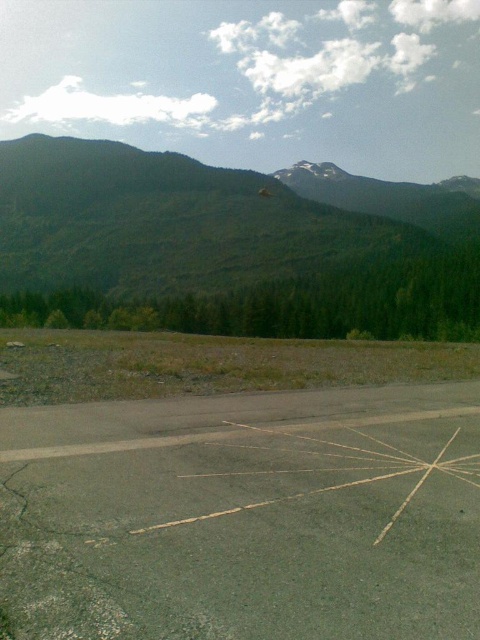
Does gray asphalt parking lot at center have a larger size compared to green forested mountain at upper left?

Incorrect, gray asphalt parking lot at center is not larger than green forested mountain at upper left.

Does point (393, 406) come farther from viewer compared to point (459, 260)?

No, (393, 406) is in front of (459, 260).

Which is in front, point (214, 516) or point (280, 269)?

Point (214, 516) is more forward.

At what (x,y) coordinates should I click in order to perform the action: click on gray asphalt parking lot at center. Please return your answer as a coordinate pair (x, y). The image size is (480, 640). Looking at the image, I should click on (244, 516).